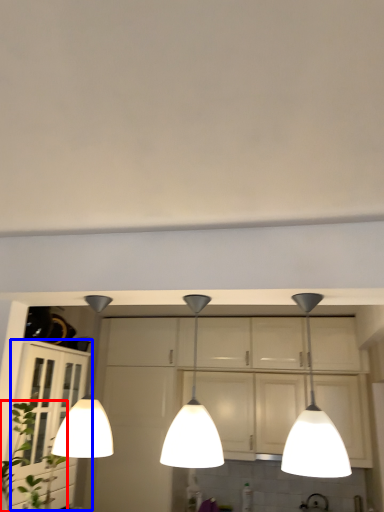
Question: Among these objects, which one is nearest to the camera, plant (highlighted by a red box) or cabinetry (highlighted by a blue box)?

Choices:
 (A) plant
 (B) cabinetry

Answer: (A)